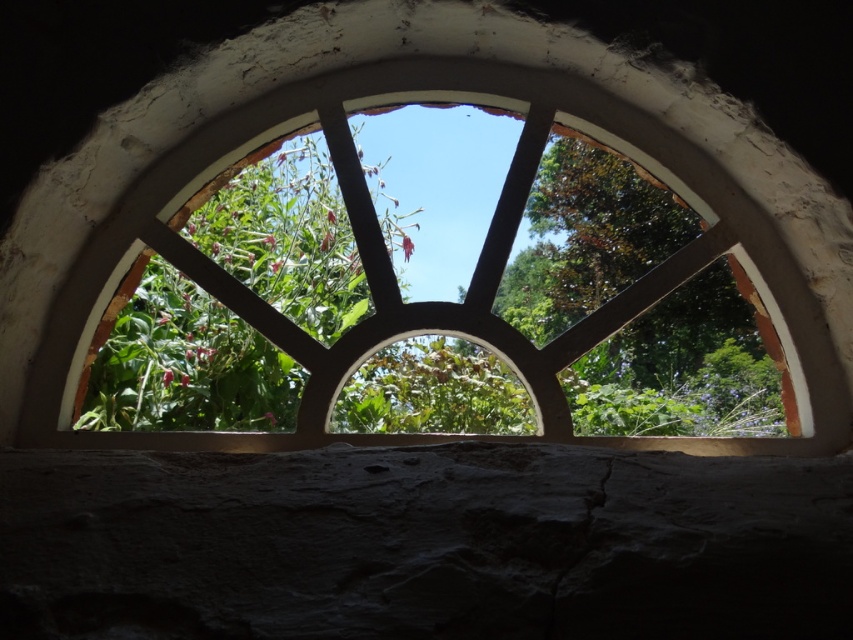
Question: Which object appears farthest from the camera in this image?

Choices:
 (A) green leafy tree at center
 (B) wooden at center

Answer: (A)

Question: Is wooden at center thinner than green leafy tree at center?

Choices:
 (A) yes
 (B) no

Answer: (B)

Question: Does wooden at center appear under green leafy tree at center?

Choices:
 (A) yes
 (B) no

Answer: (B)

Question: Does wooden at center appear on the right side of green leafy tree at center?

Choices:
 (A) yes
 (B) no

Answer: (B)

Question: Which point is closer to the camera?

Choices:
 (A) (128, 106)
 (B) (566, 225)

Answer: (A)